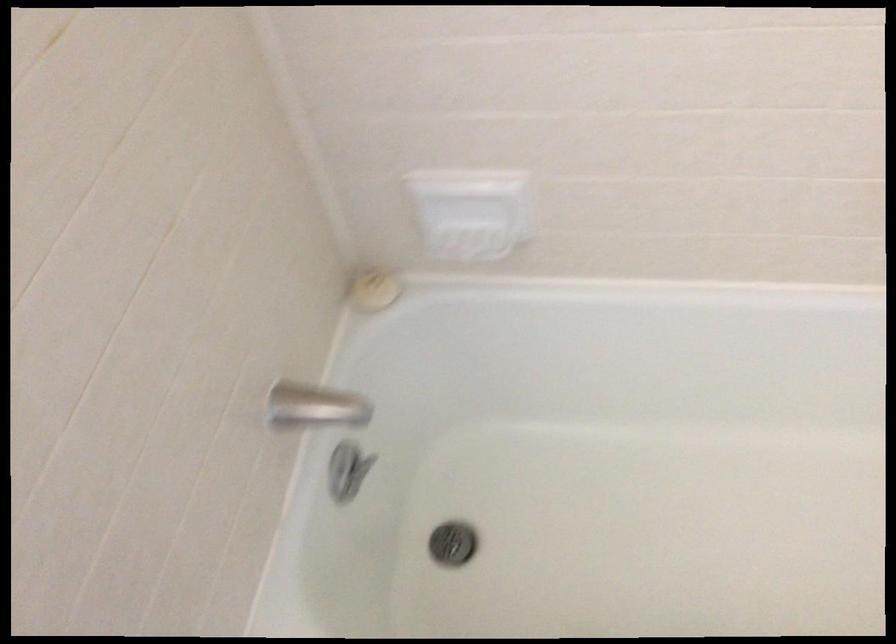
The image size is (896, 644). I want to click on bar of soap, so click(374, 290).